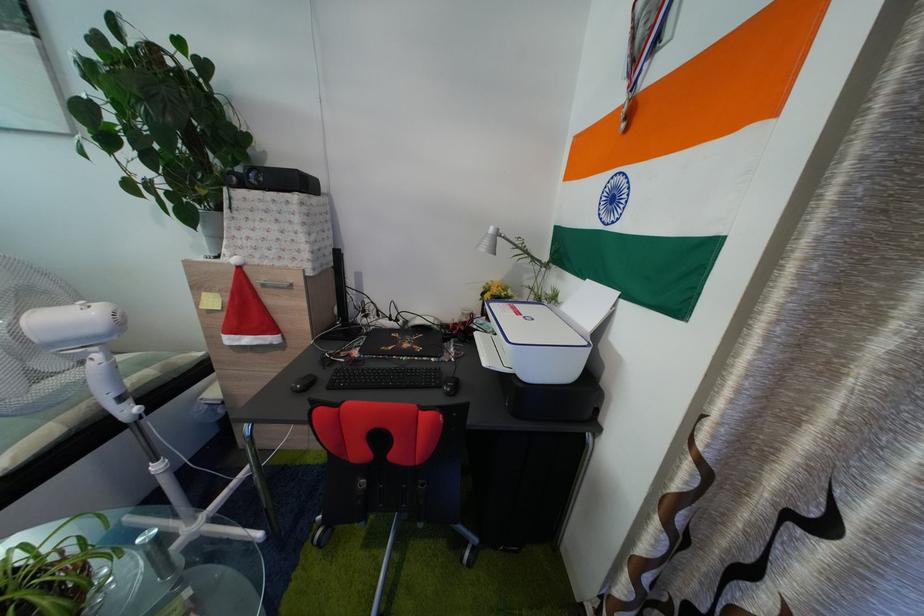
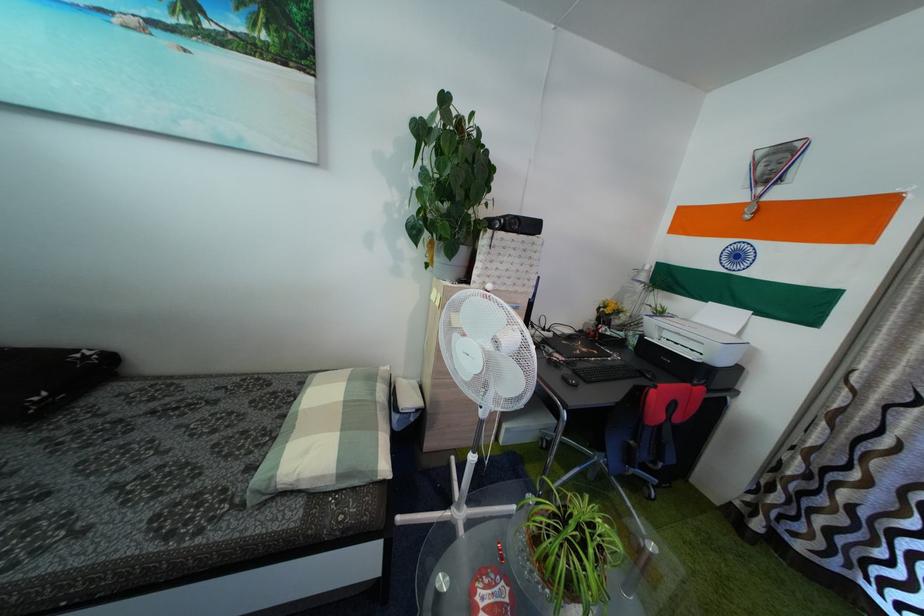
Question: What movement of the cameraman would produce the second image?

Choices:
 (A) Left
 (B) Right
 (C) Forward
 (D) Backward

Answer: (A)